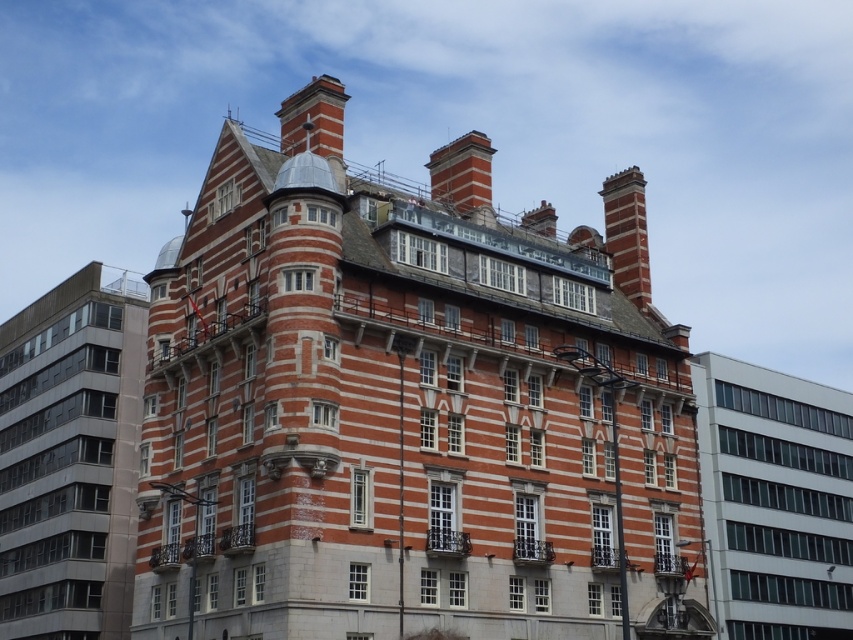
Question: Can you confirm if red brick building at center is positioned above red brick chimney at upper center?

Choices:
 (A) no
 (B) yes

Answer: (A)

Question: Estimate the real-world distances between objects in this image. Which object is closer to the red brick building at center?

Choices:
 (A) red brick chimney at upper right
 (B) red brick chimney at upper center

Answer: (B)

Question: From the image, what is the correct spatial relationship of red brick building at center in relation to red brick chimney at upper center?

Choices:
 (A) below
 (B) above

Answer: (A)

Question: Is red brick building at center to the right of red brick chimney at upper right from the viewer's perspective?

Choices:
 (A) no
 (B) yes

Answer: (A)

Question: Estimate the real-world distances between objects in this image. Which object is closer to the red brick chimney at upper right?

Choices:
 (A) red brick chimney at upper center
 (B) red brick building at center

Answer: (A)

Question: Which object is the closest to the red brick building at center?

Choices:
 (A) red brick chimney at upper center
 (B) red brick chimney at upper right

Answer: (A)